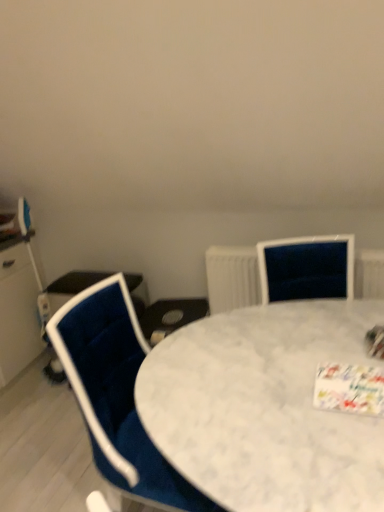
Locate an element on the screen. blank space situated above white marble table at center (from a real-world perspective) is located at coordinates (237, 377).